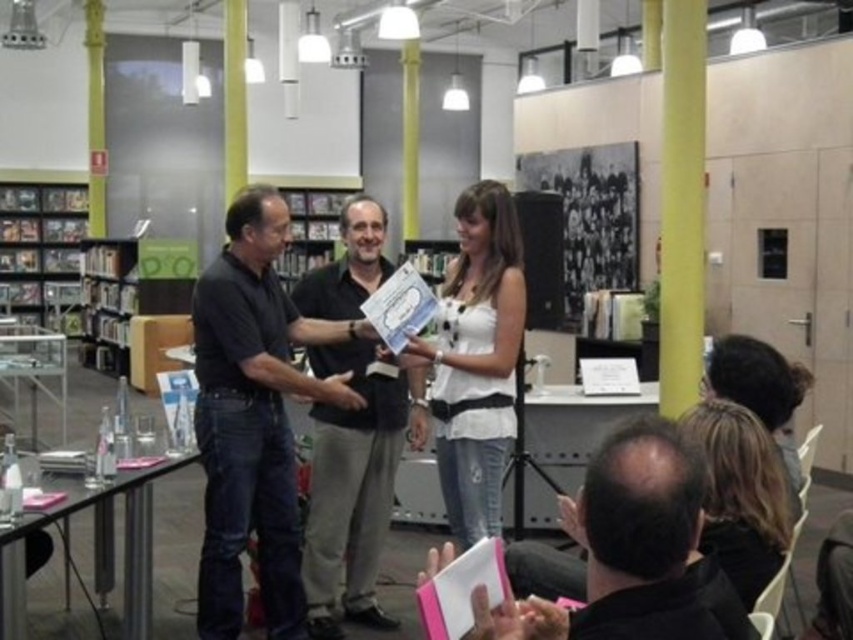
Can you confirm if black matte shirt at lower right is wider than blonde hair at lower right?

Yes.

Can you confirm if black matte shirt at lower right is taller than blonde hair at lower right?

In fact, black matte shirt at lower right may be shorter than blonde hair at lower right.

Who is more distant from viewer, (595, 488) or (747, 497)?

Point (747, 497)

The width and height of the screenshot is (853, 640). Find the location of `black matte shirt at lower right`. black matte shirt at lower right is located at coordinates (639, 548).

Does black matte shirt at center appear on the left side of dark gray shirt at center?

Correct, you'll find black matte shirt at center to the left of dark gray shirt at center.

Where is `black matte shirt at center`? The image size is (853, 640). black matte shirt at center is located at coordinates (253, 417).

Does white denim jeans at center have a smaller size compared to blonde hair at lower right?

No.

Who is higher up, white denim jeans at center or blonde hair at lower right?

white denim jeans at center

Between point (471, 273) and point (724, 531), which one is positioned behind?

Positioned behind is point (471, 273).

Locate an element on the screen. This screenshot has width=853, height=640. white denim jeans at center is located at coordinates (476, 358).